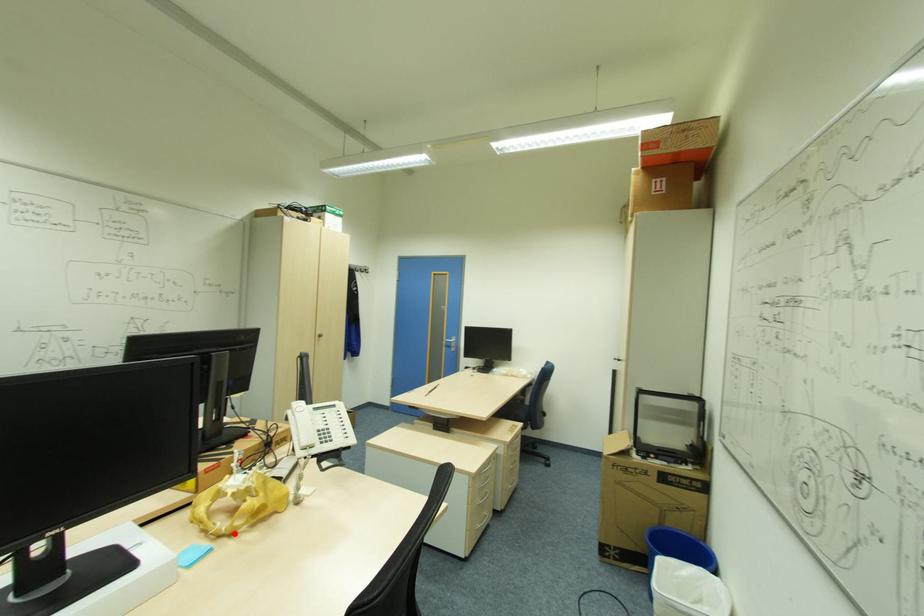
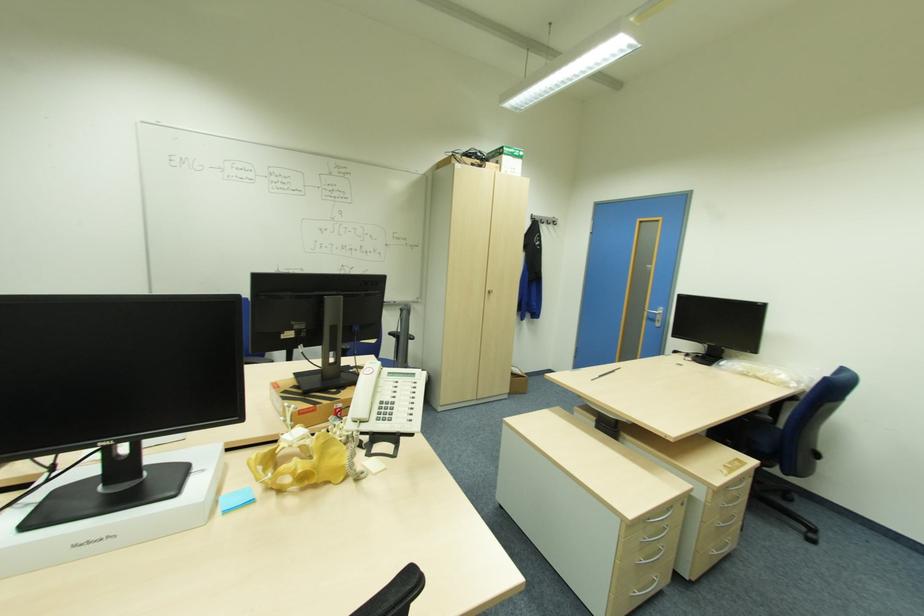
Find the pixel in the second image that matches the highlighted location in the first image.

(283, 490)